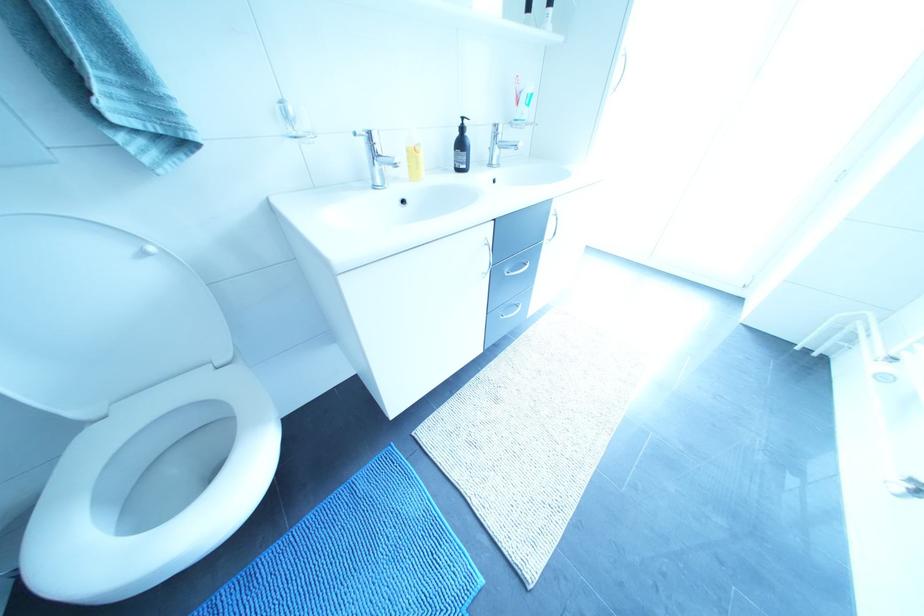
Where would you press the black dispenser pump? Please return your answer as a coordinate pair (x, y).

(460, 158)